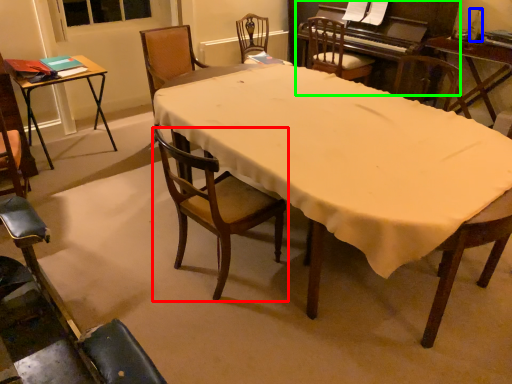
Question: Which object is the closest to the chair (highlighted by a red box)? Choose among these: bottle (highlighted by a blue box) or piano (highlighted by a green box).

Choices:
 (A) bottle
 (B) piano

Answer: (B)